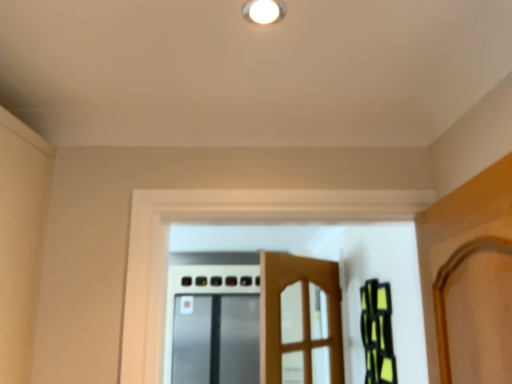
Question: Can you confirm if white glossy light fixture at upper center is shorter than satin silver screen door at center?

Choices:
 (A) no
 (B) yes

Answer: (B)

Question: Is satin silver screen door at center completely or partially inside white glossy light fixture at upper center?

Choices:
 (A) no
 (B) yes

Answer: (A)

Question: Is white glossy light fixture at upper center turned away from satin silver screen door at center?

Choices:
 (A) yes
 (B) no

Answer: (B)

Question: Is white glossy light fixture at upper center at the left side of satin silver screen door at center?

Choices:
 (A) no
 (B) yes

Answer: (A)

Question: Is the depth of white glossy light fixture at upper center less than that of satin silver screen door at center?

Choices:
 (A) no
 (B) yes

Answer: (B)

Question: From their relative heights in the image, would you say wooden door at center is taller or shorter than white glossy light fixture at upper center?

Choices:
 (A) tall
 (B) short

Answer: (A)

Question: From the image's perspective, is wooden door at center above or below white glossy light fixture at upper center?

Choices:
 (A) below
 (B) above

Answer: (A)

Question: From a real-world perspective, is wooden door at center physically located above or below white glossy light fixture at upper center?

Choices:
 (A) below
 (B) above

Answer: (A)

Question: Is wooden door at center wider or thinner than white glossy light fixture at upper center?

Choices:
 (A) thin
 (B) wide

Answer: (B)

Question: In terms of width, does wooden door at center look wider or thinner when compared to satin silver screen door at center?

Choices:
 (A) thin
 (B) wide

Answer: (A)

Question: Is point (306, 274) closer or farther from the camera than point (183, 301)?

Choices:
 (A) closer
 (B) farther

Answer: (A)

Question: Choose the correct answer: Is wooden door at center inside satin silver screen door at center or outside it?

Choices:
 (A) inside
 (B) outside

Answer: (B)

Question: Visually, is wooden door at center positioned to the left or to the right of satin silver screen door at center?

Choices:
 (A) right
 (B) left

Answer: (A)

Question: Considering the positions of white glossy light fixture at upper center and satin silver screen door at center in the image, is white glossy light fixture at upper center wider or thinner than satin silver screen door at center?

Choices:
 (A) thin
 (B) wide

Answer: (A)

Question: In terms of height, does white glossy light fixture at upper center look taller or shorter compared to satin silver screen door at center?

Choices:
 (A) tall
 (B) short

Answer: (B)